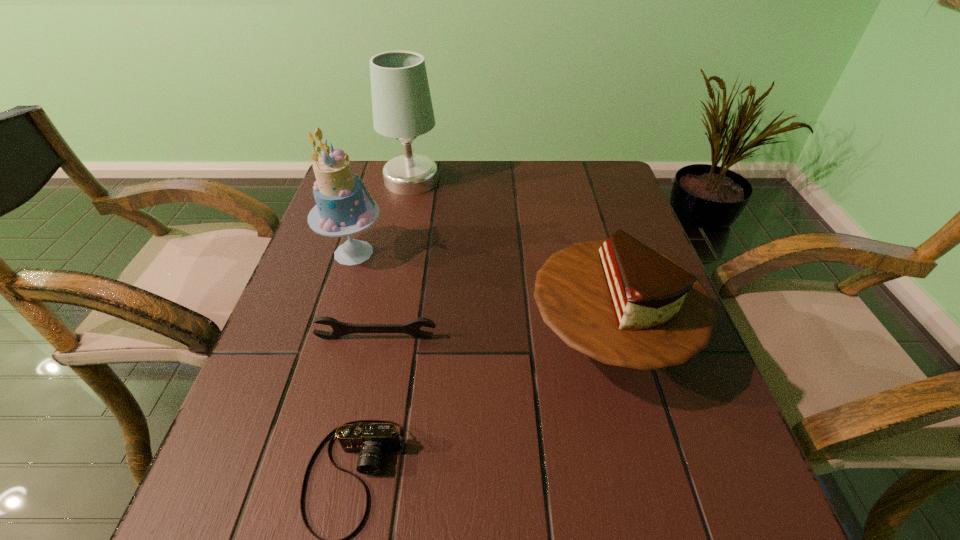
The image size is (960, 540). I want to click on the farthest object, so click(402, 107).

Identify the location of the fourth nearest object. The width and height of the screenshot is (960, 540). (342, 208).

Locate an element on the screen. the left cake is located at coordinates (342, 208).

Image resolution: width=960 pixels, height=540 pixels. In order to click on the nearer cake in this screenshot , I will do `click(618, 301)`.

You are a GUI agent. You are given a task and a screenshot of the screen. Output one action in this format:
    pyautogui.click(x=<x>, y=<y>)
    Task: Click on the right cake
    The image size is (960, 540).
    Given the screenshot: What is the action you would take?
    pyautogui.click(x=618, y=301)

The width and height of the screenshot is (960, 540). Find the location of `wrench`. wrench is located at coordinates (413, 327).

I want to click on vacant space located 0.190m on the base of the lampshade, so click(505, 180).

Locate an element on the screen. This screenshot has height=540, width=960. vacant space located 0.100m with a ladder on the side of the left cake is located at coordinates (428, 253).

Where is `vacant space located 0.050m on the back of the rightmost object`? vacant space located 0.050m on the back of the rightmost object is located at coordinates (590, 266).

Where is `vacant area located on the open ends of the wrench`? The width and height of the screenshot is (960, 540). vacant area located on the open ends of the wrench is located at coordinates (350, 462).